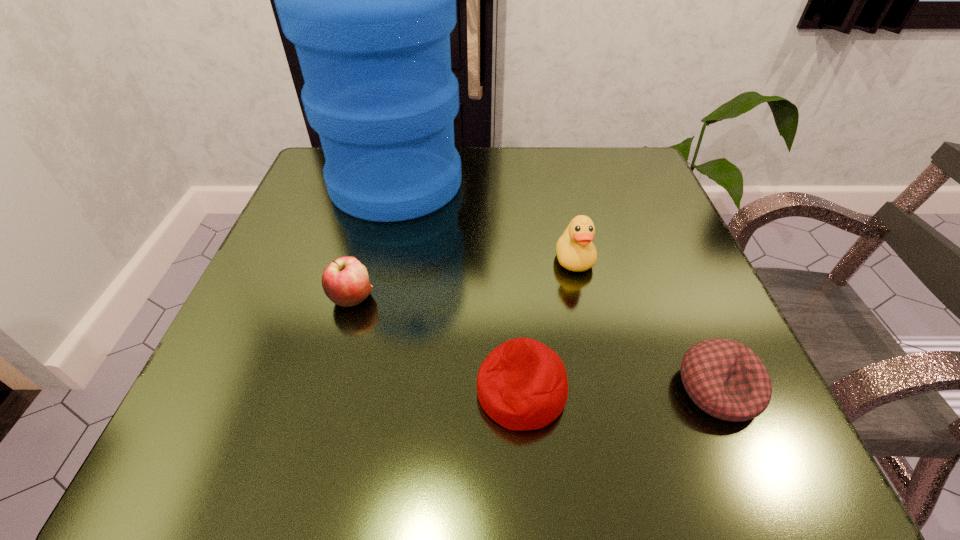
Locate an element on the screen. free location located 0.370m on the seat area of the third object from right to left is located at coordinates (208, 391).

Where is `vacant region located 0.270m on the seat area of the third object from right to left`? Image resolution: width=960 pixels, height=540 pixels. vacant region located 0.270m on the seat area of the third object from right to left is located at coordinates (281, 391).

Identify the location of vacant space located 0.150m on the seat area of the third object from right to left. The height and width of the screenshot is (540, 960). (368, 391).

This screenshot has height=540, width=960. In order to click on free location located on the back of the right beanbag in this screenshot , I will do `click(647, 225)`.

You are a GUI agent. You are given a task and a screenshot of the screen. Output one action in this format:
    pyautogui.click(x=<x>, y=<y>)
    Task: Click on the object located in the far edge section of the desktop
    The width and height of the screenshot is (960, 540).
    Given the screenshot: What is the action you would take?
    pyautogui.click(x=369, y=0)

Locate an element on the screen. water jug at the left edge is located at coordinates (369, 0).

Where is `apple that is positioned at the left edge`? This screenshot has height=540, width=960. apple that is positioned at the left edge is located at coordinates (345, 281).

Locate an element on the screen. The height and width of the screenshot is (540, 960). object that is at the right edge is located at coordinates (726, 379).

Locate an element on the screen. object that is at the far left corner is located at coordinates (369, 0).

The height and width of the screenshot is (540, 960). I want to click on object that is at the near right corner, so click(726, 379).